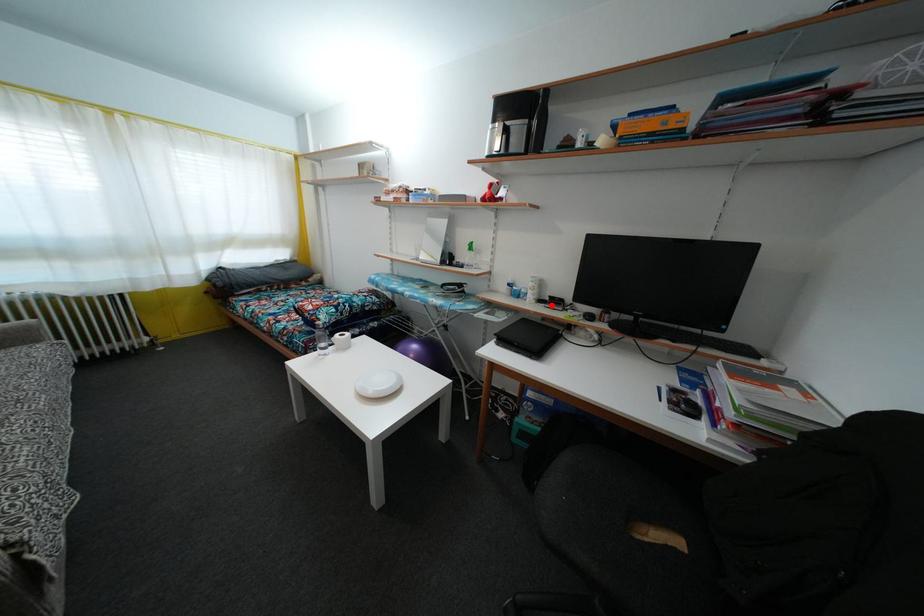
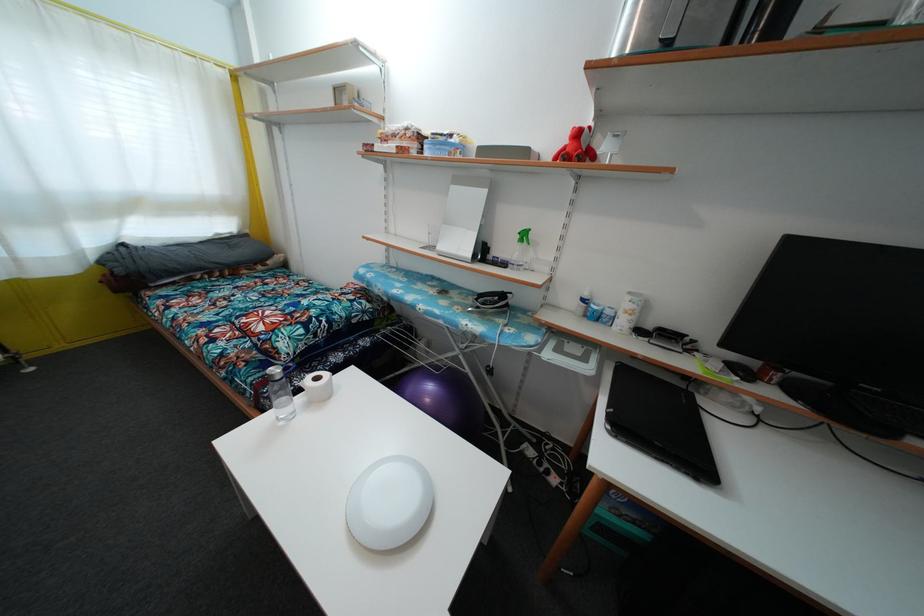
Where in the second image is the point corresponding to the highlighted location from the first image?

(652, 334)